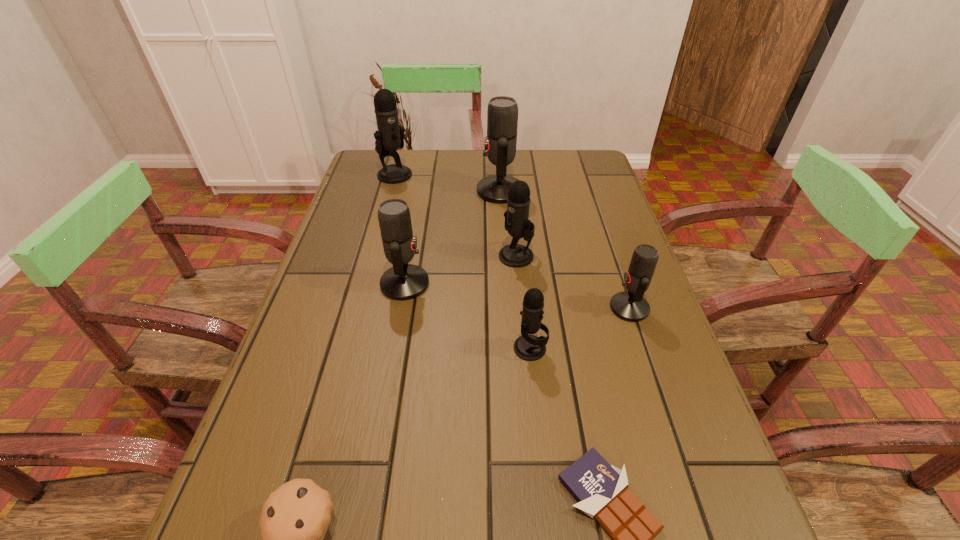
Locate an element on the screen. The height and width of the screenshot is (540, 960). the second red microphone from left to right is located at coordinates (502, 114).

Find the location of a particular element. the farthest red microphone is located at coordinates (502, 114).

In order to click on the leftmost black microphone in this screenshot , I will do `click(389, 137)`.

Where is `the biggest black microphone`? This screenshot has height=540, width=960. the biggest black microphone is located at coordinates (389, 137).

Where is `the second smallest red microphone`? This screenshot has width=960, height=540. the second smallest red microphone is located at coordinates (403, 281).

Image resolution: width=960 pixels, height=540 pixels. I want to click on the second biggest black microphone, so click(x=517, y=224).

Locate an element on the screen. This screenshot has width=960, height=540. the smallest red microphone is located at coordinates (631, 306).

Where is `the rightmost microphone`? This screenshot has width=960, height=540. the rightmost microphone is located at coordinates (631, 306).

This screenshot has width=960, height=540. Find the location of `the nearest microphone`. the nearest microphone is located at coordinates (527, 347).

The width and height of the screenshot is (960, 540). What are the coordinates of `the smallest black microphone` in the screenshot? It's located at (527, 347).